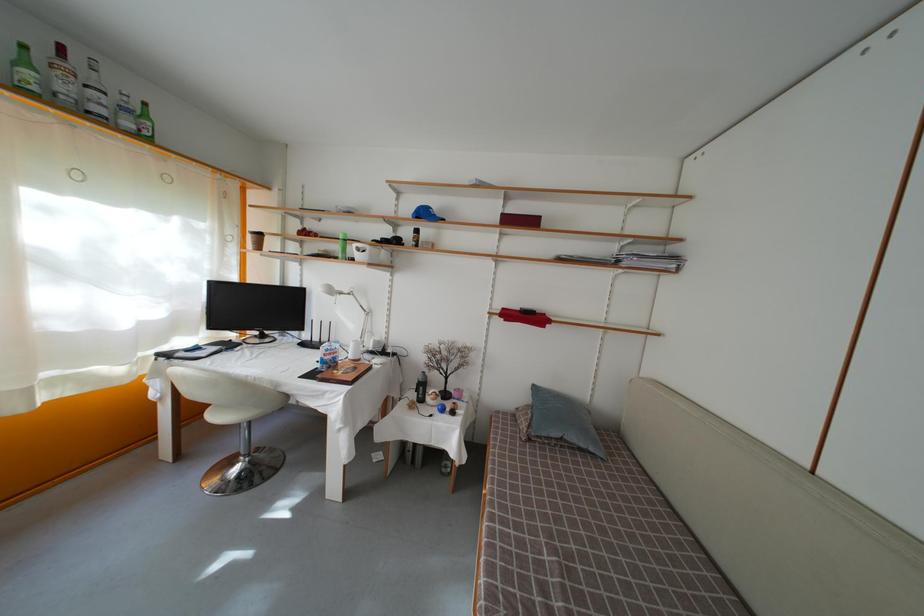
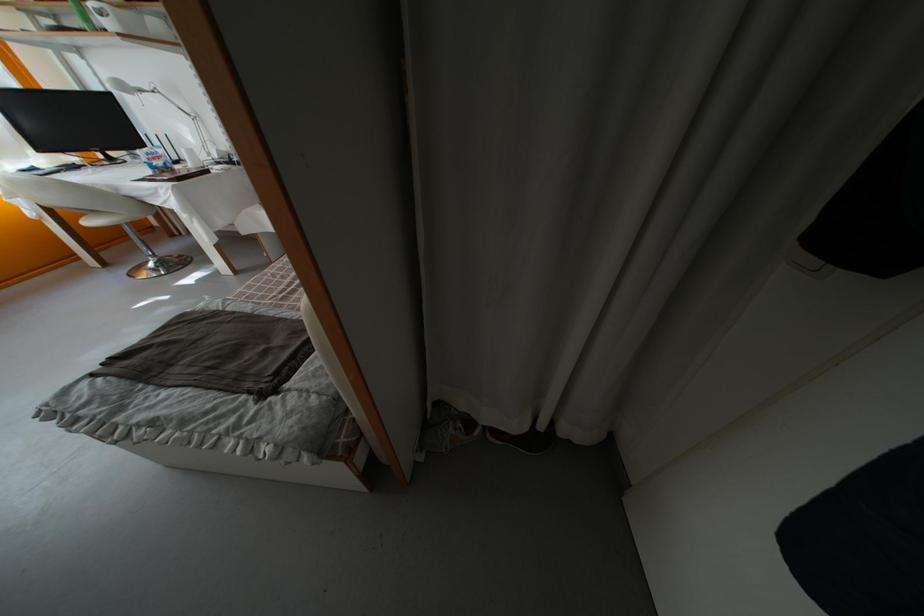
Locate, in the second image, the point that corresponds to [343,294] in the first image.

(139, 91)